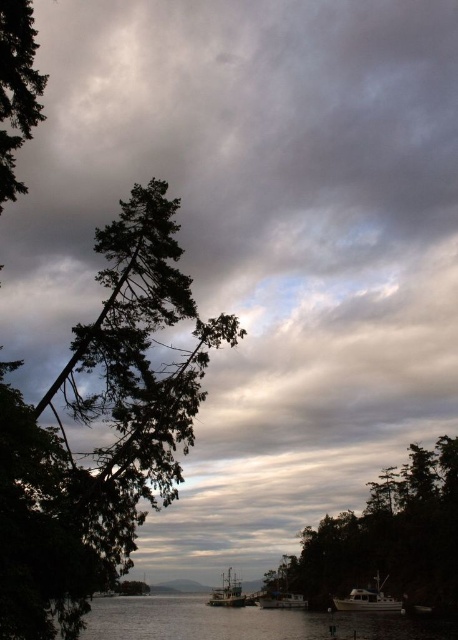
Question: Is green matte tree at center smaller than wooden fishing boat at center?

Choices:
 (A) yes
 (B) no

Answer: (B)

Question: Based on their relative distances, which object is nearer to the wooden fishing boat at lower center?

Choices:
 (A) dark green leafy tree at left
 (B) wooden fishing boat at center
 (C) dark green textured tree at left

Answer: (B)

Question: Which object appears farthest from the camera in this image?

Choices:
 (A) green matte tree at center
 (B) dark green leafy tree at left
 (C) dark green textured tree at left

Answer: (A)

Question: Observing the image, what is the correct spatial positioning of wooden fishing boat at center in reference to white matte boat at center?

Choices:
 (A) above
 (B) below

Answer: (B)

Question: Does wooden fishing boat at center appear over white matte boat at center?

Choices:
 (A) yes
 (B) no

Answer: (B)

Question: Which object is closer to the camera taking this photo?

Choices:
 (A) dark green textured tree at left
 (B) wooden fishing boat at lower center

Answer: (A)